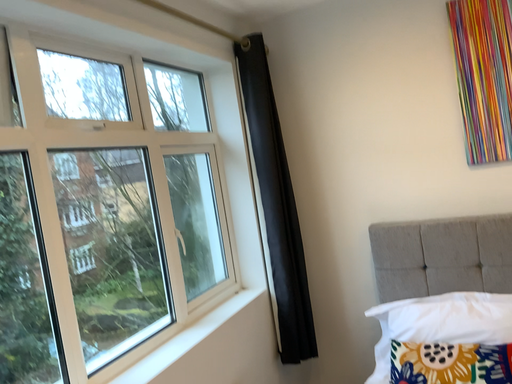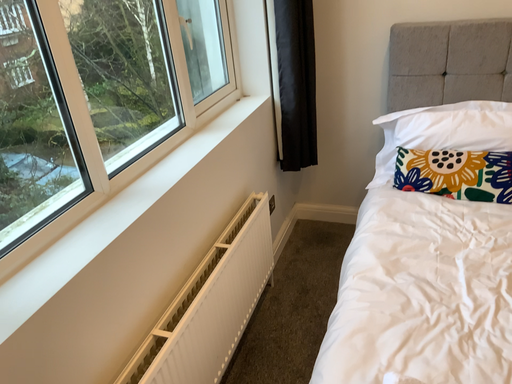
Question: Which way did the camera rotate in the video?

Choices:
 (A) rotated left
 (B) rotated right

Answer: (B)